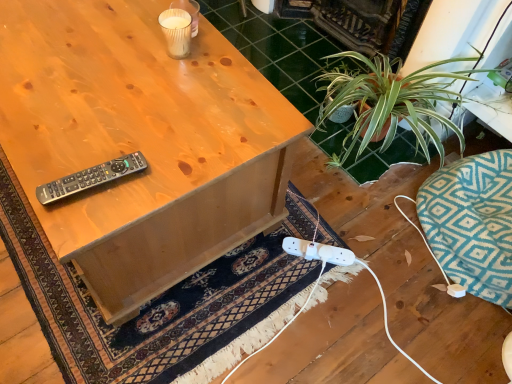
Find the location of a particular element. empty space that is ontop of matte wood desk at center (from a real-world perspective) is located at coordinates (103, 104).